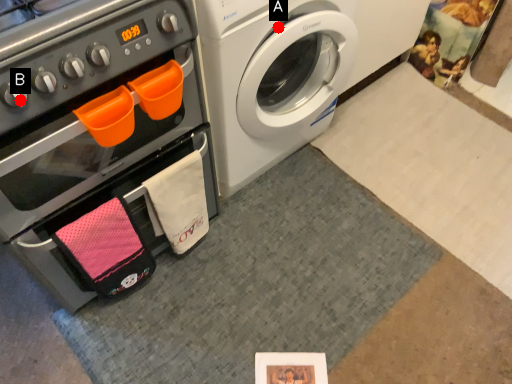
Question: Two points are circled on the image, labeled by A and B beside each circle. Which of the following is the farthest from the observer?

Choices:
 (A) A is further
 (B) B is further

Answer: (A)